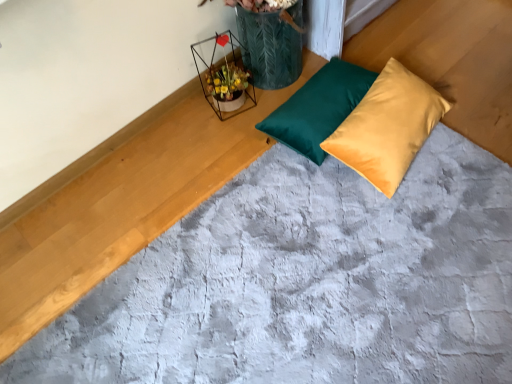
Question: Is satin yellow pillow at center, which appears as the 1th pillow when viewed from the right, in contact with metallic wire flower basket at upper center?

Choices:
 (A) no
 (B) yes

Answer: (A)

Question: Is the position of satin yellow pillow at center, the second pillow when ordered from left to right, less distant than that of metallic wire flower basket at upper center?

Choices:
 (A) yes
 (B) no

Answer: (A)

Question: Is satin yellow pillow at center, which appears as the 1th pillow when viewed from the right, turned away from metallic wire flower basket at upper center?

Choices:
 (A) no
 (B) yes

Answer: (B)

Question: From the image's perspective, is satin yellow pillow at center, the second pillow when ordered from left to right, on top of metallic wire flower basket at upper center?

Choices:
 (A) no
 (B) yes

Answer: (A)

Question: Considering the relative sizes of satin yellow pillow at center, the second pillow when ordered from left to right, and metallic wire flower basket at upper center in the image provided, is satin yellow pillow at center, the second pillow when ordered from left to right, taller than metallic wire flower basket at upper center?

Choices:
 (A) yes
 (B) no

Answer: (B)

Question: Is metallic wire flower basket at upper center wider or thinner than teal satin pillow at center, which is the second pillow in right-to-left order?

Choices:
 (A) thin
 (B) wide

Answer: (A)

Question: Based on their sizes in the image, would you say metallic wire flower basket at upper center is bigger or smaller than teal satin pillow at center, which is the second pillow in right-to-left order?

Choices:
 (A) small
 (B) big

Answer: (A)

Question: In terms of height, does metallic wire flower basket at upper center look taller or shorter compared to teal satin pillow at center, marked as the first pillow in a left-to-right arrangement?

Choices:
 (A) tall
 (B) short

Answer: (A)

Question: From a real-world perspective, relative to teal satin pillow at center, marked as the first pillow in a left-to-right arrangement, is metallic wire flower basket at upper center vertically above or below?

Choices:
 (A) above
 (B) below

Answer: (A)

Question: In the image, is metallic wire flower basket at upper center positioned in front of or behind satin yellow pillow at center, the second pillow when ordered from left to right?

Choices:
 (A) behind
 (B) front

Answer: (A)

Question: Considering the positions of metallic wire flower basket at upper center and satin yellow pillow at center, which appears as the 1th pillow when viewed from the right, in the image, is metallic wire flower basket at upper center taller or shorter than satin yellow pillow at center, which appears as the 1th pillow when viewed from the right,?

Choices:
 (A) short
 (B) tall

Answer: (B)

Question: From a real-world perspective, is metallic wire flower basket at upper center physically located above or below satin yellow pillow at center, which appears as the 1th pillow when viewed from the right?

Choices:
 (A) above
 (B) below

Answer: (A)

Question: Looking at the image, does metallic wire flower basket at upper center seem bigger or smaller compared to satin yellow pillow at center, which appears as the 1th pillow when viewed from the right?

Choices:
 (A) small
 (B) big

Answer: (A)

Question: Considering the positions of satin yellow pillow at center, the second pillow when ordered from left to right, and teal satin pillow at center, marked as the first pillow in a left-to-right arrangement, in the image, is satin yellow pillow at center, the second pillow when ordered from left to right, taller or shorter than teal satin pillow at center, marked as the first pillow in a left-to-right arrangement,?

Choices:
 (A) tall
 (B) short

Answer: (A)

Question: From a real-world perspective, is satin yellow pillow at center, which appears as the 1th pillow when viewed from the right, above or below teal satin pillow at center, which is the second pillow in right-to-left order?

Choices:
 (A) above
 (B) below

Answer: (A)